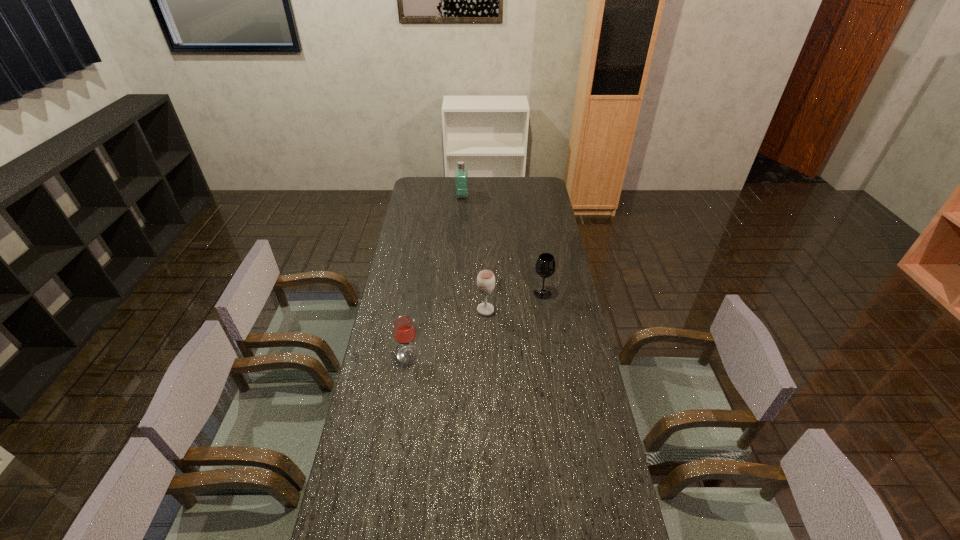
Image resolution: width=960 pixels, height=540 pixels. Identify the location of vacant space located 0.250m on the left of the third farthest object. (415, 310).

Where is `vacant space located 0.400m on the back of the nearest wineglass`? This screenshot has width=960, height=540. vacant space located 0.400m on the back of the nearest wineglass is located at coordinates (420, 275).

The image size is (960, 540). Find the location of `object located at the far edge`. object located at the far edge is located at coordinates (461, 172).

Locate an element on the screen. This screenshot has height=540, width=960. object present at the left edge is located at coordinates (404, 329).

Locate an element on the screen. This screenshot has height=540, width=960. object that is at the right edge is located at coordinates (545, 266).

The width and height of the screenshot is (960, 540). I want to click on vacant space at the far edge of the desktop, so click(492, 179).

Where is `free space at the left edge`? Image resolution: width=960 pixels, height=540 pixels. free space at the left edge is located at coordinates (346, 478).

In the image, there is a desktop. Identify the location of free space at the right edge. The height and width of the screenshot is (540, 960). (580, 477).

Identify the location of free region at the far right corner of the desktop. The height and width of the screenshot is (540, 960). (544, 188).

Where is `blank region between the rightmost object and the nearest wineglass`? The image size is (960, 540). blank region between the rightmost object and the nearest wineglass is located at coordinates (475, 324).